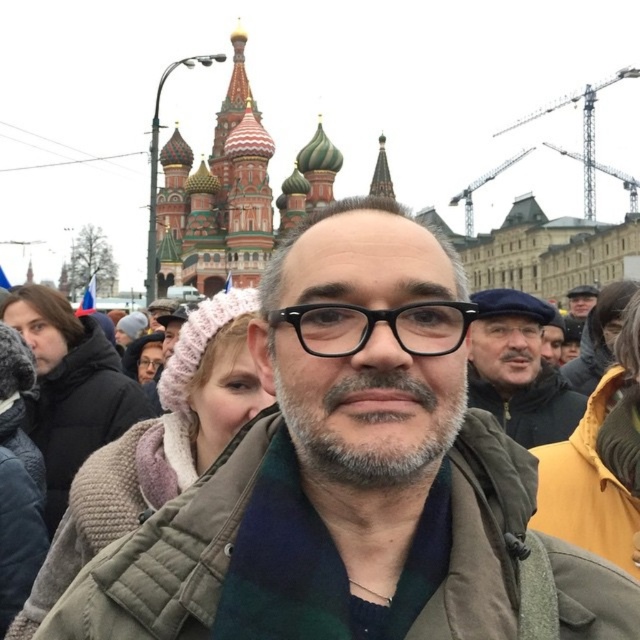
Question: Which point appears closest to the camera in this image?

Choices:
 (A) (349, 454)
 (B) (410, 442)
 (C) (138, 401)

Answer: (A)

Question: Among these points, which one is farthest from the camera?

Choices:
 (A) (412, 474)
 (B) (298, 442)

Answer: (B)

Question: Does gray matte beard at center appear over dark blue woolen hat at upper right?

Choices:
 (A) no
 (B) yes

Answer: (A)

Question: Can you confirm if green plaid scarf at center is thinner than dark gray knit hat at upper left?

Choices:
 (A) yes
 (B) no

Answer: (B)

Question: Which point is closer to the camera?

Choices:
 (A) (509, 435)
 (B) (355, 392)

Answer: (B)

Question: Is green plaid scarf at center further to camera compared to dark blue woolen hat at upper right?

Choices:
 (A) yes
 (B) no

Answer: (B)